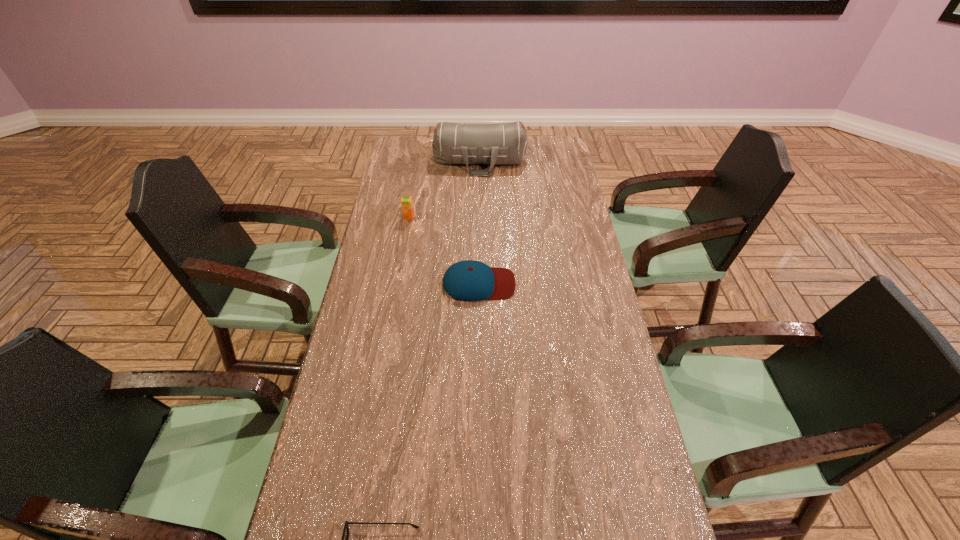
Where is `object present at the left edge`? object present at the left edge is located at coordinates (406, 202).

In the image, there is a desktop. Identify the location of vacant space at the left edge. The image size is (960, 540). (364, 488).

This screenshot has height=540, width=960. I want to click on free space at the right edge of the desktop, so click(x=590, y=336).

In the image, there is a desktop. At what (x,y) coordinates should I click in order to perform the action: click on vacant space at the far right corner. Please return your answer as a coordinate pair (x, y). The width and height of the screenshot is (960, 540). Looking at the image, I should click on (553, 137).

This screenshot has width=960, height=540. In order to click on empty space that is in between the third tallest object and the tallest object in this screenshot , I will do `click(479, 222)`.

The width and height of the screenshot is (960, 540). In order to click on empty space that is in between the third tallest object and the third nearest object in this screenshot , I will do `click(444, 250)`.

Image resolution: width=960 pixels, height=540 pixels. What are the coordinates of `vacant area that lies between the farthest object and the third shortest object` in the screenshot? It's located at (444, 189).

At what (x,y) coordinates should I click in order to perform the action: click on free space between the second nearest object and the third shortest object. Please return your answer as a coordinate pair (x, y). This screenshot has width=960, height=540. Looking at the image, I should click on pyautogui.click(x=444, y=250).

Locate an element on the screen. Image resolution: width=960 pixels, height=540 pixels. empty space that is in between the tallest object and the third farthest object is located at coordinates (479, 222).

Locate an element on the screen. free space between the farthest object and the baseball cap is located at coordinates (479, 222).